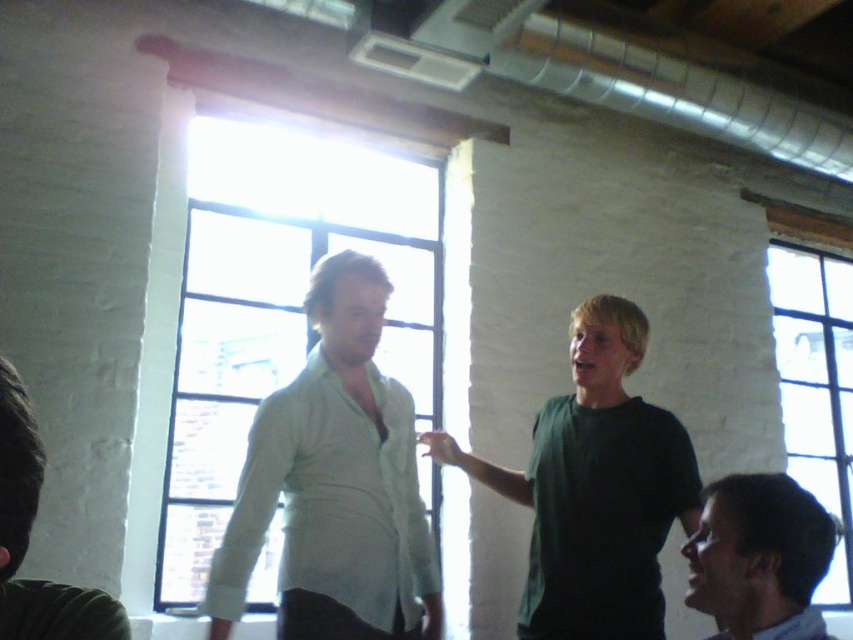
Is green matte shirt at center above dark green shirt at lower right?

Yes.

Who is lower down, green matte shirt at center or dark green shirt at lower right?

dark green shirt at lower right

Between point (587, 524) and point (703, 513), which one is positioned in front?

Point (703, 513) is in front.

Find the location of a particular element. green matte shirt at center is located at coordinates (595, 488).

This screenshot has height=640, width=853. In order to click on clear glass window at upper right in this screenshot , I will do `click(816, 387)`.

Does point (790, 374) come behind point (753, 547)?

Yes, it is.

Identify the location of clear glass window at upper right. This screenshot has height=640, width=853. (816, 387).

You are a GUI agent. You are given a task and a screenshot of the screen. Output one action in this format:
    pyautogui.click(x=<x>, y=<y>)
    Task: Click on the clear glass window at upper right
    Image resolution: width=853 pixels, height=640 pixels.
    Given the screenshot: What is the action you would take?
    pyautogui.click(x=816, y=387)

Is the position of light green fabric shirt at center less distant than that of dark green shirt at left?

No.

Is light green fabric shirt at center shorter than dark green shirt at left?

Incorrect, light green fabric shirt at center's height does not fall short of dark green shirt at left's.

Does point (366, 614) lie in front of point (3, 449)?

That is False.

This screenshot has height=640, width=853. I want to click on light green fabric shirt at center, so click(335, 483).